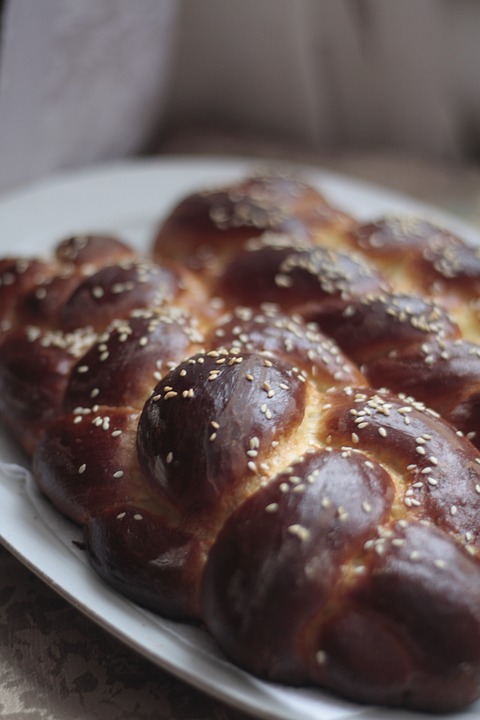
Identify the location of plate shadow. (39, 649).